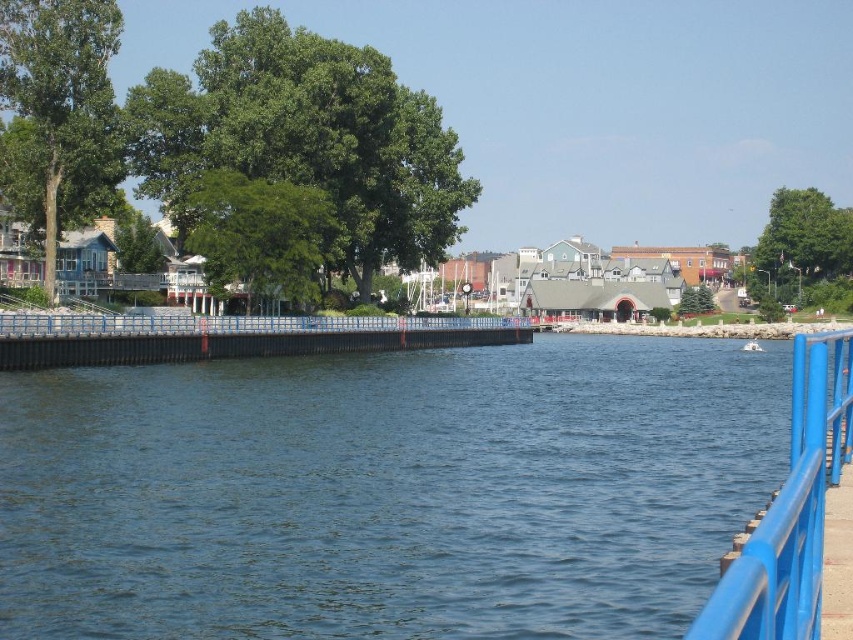
You are standing on the wooden pier on the left side of the waterfront scene. You want to walk towards the blue metallic railing at right and the white plastic boat at center. Which object will you encounter first as you move towards them?

The blue metallic railing at right is to the left of the white plastic boat at center, so you will encounter the blue metallic railing at right first as you move towards them.

In the scene shown: You are standing at the blue railing on the right side of the waterfront scene. You want to walk directly towards the blue metallic river at center. Which direction should you move?

Since the blue metallic river at center is located at point 0.769 on the x axis and 0.454 on the y axis, you should move to the left and slightly forward to reach it.

You are a small toy boat operator. You see the blue metallic river at center and the white plastic boat at center. Which one is wider?

The blue metallic river at center is wider than the white plastic boat at center according to the description.